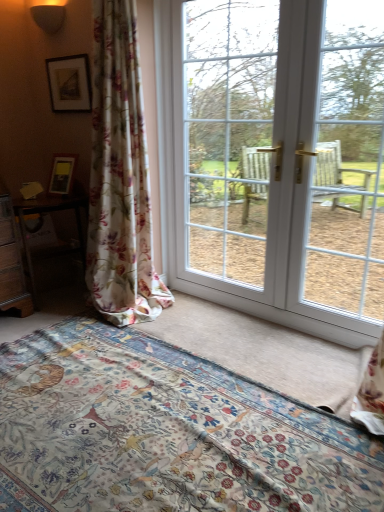
Question: From their relative heights in the image, would you say floral fabric curtain at left is taller or shorter than white glass window at center, the 1th window screen from the left?

Choices:
 (A) short
 (B) tall

Answer: (B)

Question: Considering their positions, is floral fabric curtain at left located in front of or behind white glass window at center, the 1th window screen from the left?

Choices:
 (A) front
 (B) behind

Answer: (A)

Question: Considering the real-world distances, which object is closest to the white glossy door at center?

Choices:
 (A) white glass window at center, the 2th window screen when ordered from right to left
 (B) floral fabric bed at lower center
 (C) matte black sconce at upper left
 (D) clear glass door at right, the second window screen from the left
 (E) matte black picture frame at upper left

Answer: (A)

Question: Which object is positioned farthest from the floral fabric bed at lower center?

Choices:
 (A) white glossy door at center
 (B) wooden table at left
 (C) matte black picture frame at upper left
 (D) matte black sconce at upper left
 (E) clear glass door at right, the second window screen from the left

Answer: (D)